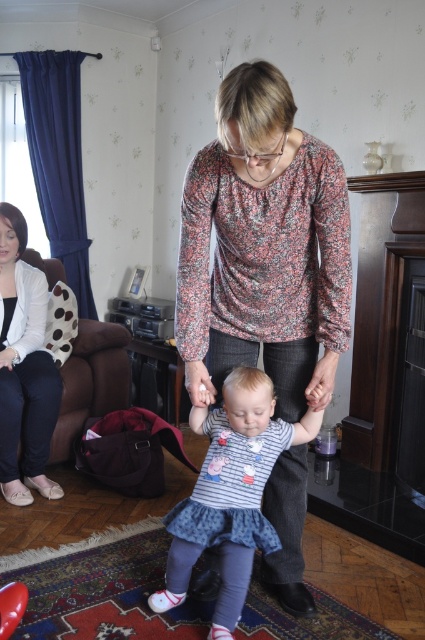
Can you confirm if floral print blouse at center is thinner than denim dress at center?

Yes.

Which is more to the right, floral print blouse at center or denim dress at center?

floral print blouse at center

What do you see at coordinates (263, 248) in the screenshot? The height and width of the screenshot is (640, 425). I see `floral print blouse at center` at bounding box center [263, 248].

At what (x,y) coordinates should I click in order to perform the action: click on floral print blouse at center. Please return your answer as a coordinate pair (x, y). Looking at the image, I should click on (263, 248).

Is floral print blouse at center to the right of brown fabric armchair at left from the viewer's perspective?

Indeed, floral print blouse at center is positioned on the right side of brown fabric armchair at left.

Who is taller, floral print blouse at center or brown fabric armchair at left?

floral print blouse at center

Measure the distance between floral print blouse at center and camera.

floral print blouse at center is 1.20 meters from camera.

Locate an element on the screen. floral print blouse at center is located at coordinates [263, 248].

How distant is floral print blouse at center from matte white sweater at left?

floral print blouse at center is 1.28 meters away from matte white sweater at left.

Describe the element at coordinates (263, 248) in the screenshot. I see `floral print blouse at center` at that location.

This screenshot has width=425, height=640. I want to click on floral print blouse at center, so click(263, 248).

I want to click on floral print blouse at center, so click(263, 248).